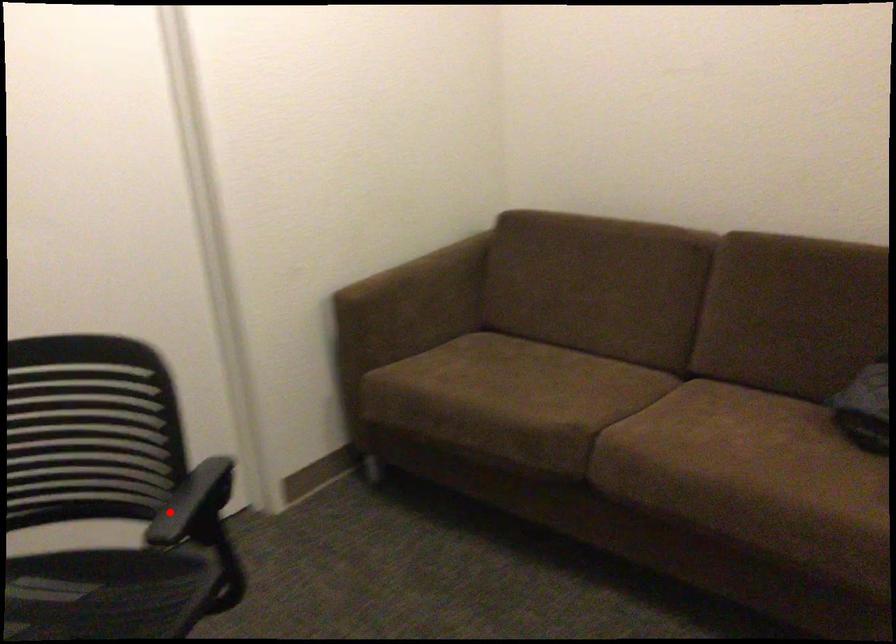
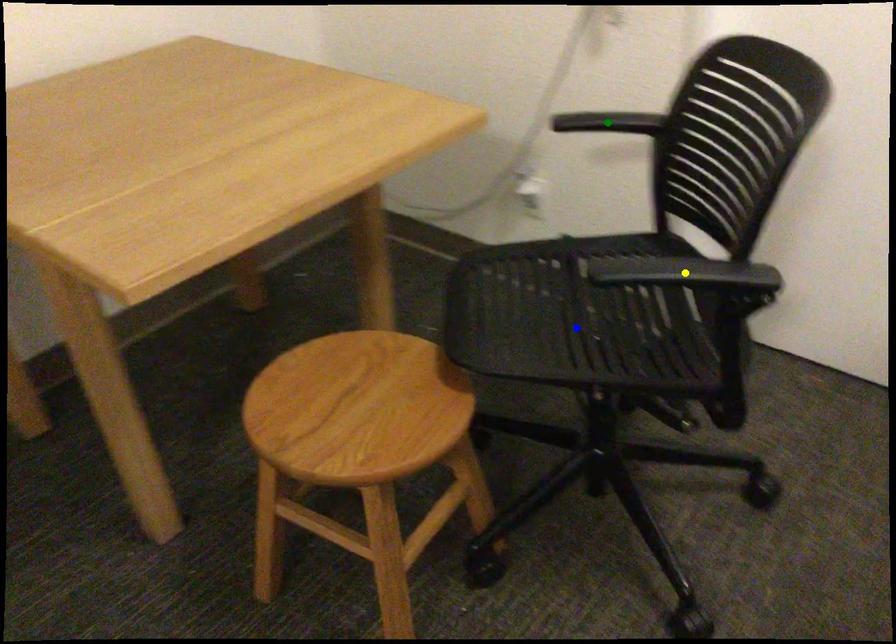
Question: I am providing you with two images of the same scene from different viewpoints. A red point is marked on the first image. You are given multiple points on the second image. In image 2, which mark is for the same physical point as the one in image 1?

Choices:
 (A) yellow point
 (B) blue point
 (C) green point

Answer: (A)